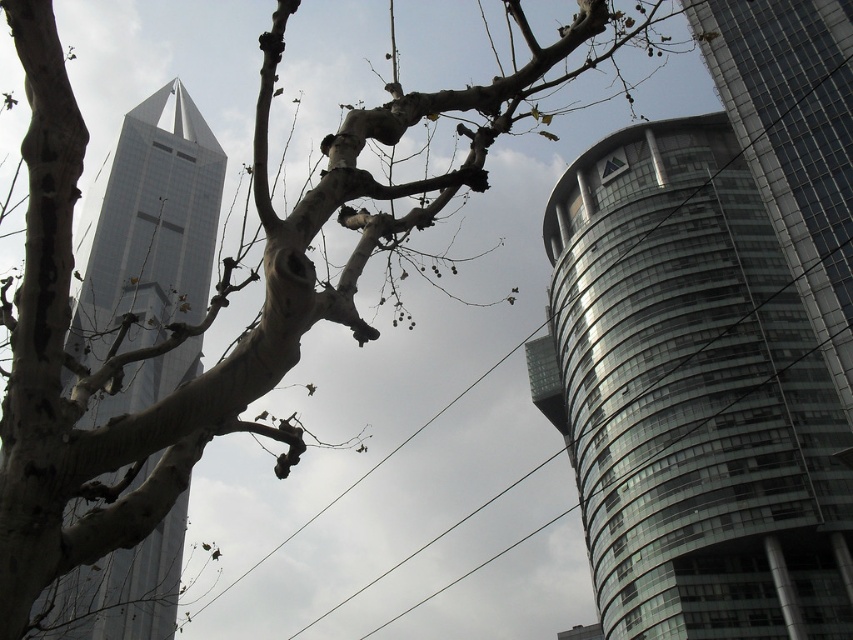
Question: Which of the following is the closest to the observer?

Choices:
 (A) [x=190, y=621]
 (B) [x=738, y=481]
 (C) [x=485, y=504]

Answer: (A)

Question: Which of the following is the farthest from the observer?

Choices:
 (A) (213, 596)
 (B) (543, 460)

Answer: (A)

Question: Considering the real-world distances, which object is closest to the glassy reflective tower at center?

Choices:
 (A) transparent wire at upper center
 (B) glassy silver skyscraper at left
 (C) black wire at center

Answer: (B)

Question: Does transparent wire at upper center have a greater width compared to black wire at center?

Choices:
 (A) yes
 (B) no

Answer: (A)

Question: In this image, where is glassy reflective tower at center located relative to glassy silver skyscraper at left?

Choices:
 (A) above
 (B) below

Answer: (B)

Question: Can you confirm if glassy silver skyscraper at left is bigger than black wire at center?

Choices:
 (A) yes
 (B) no

Answer: (A)